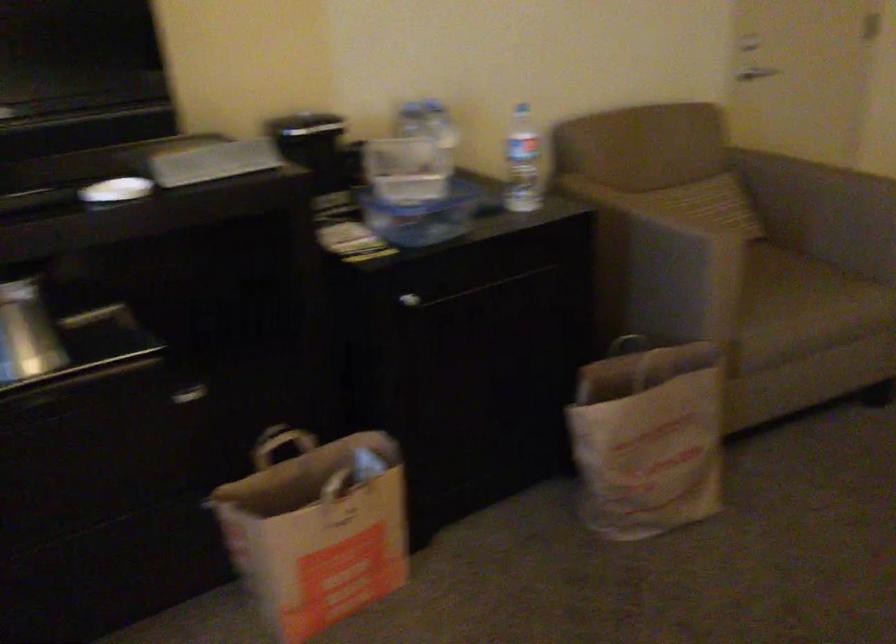
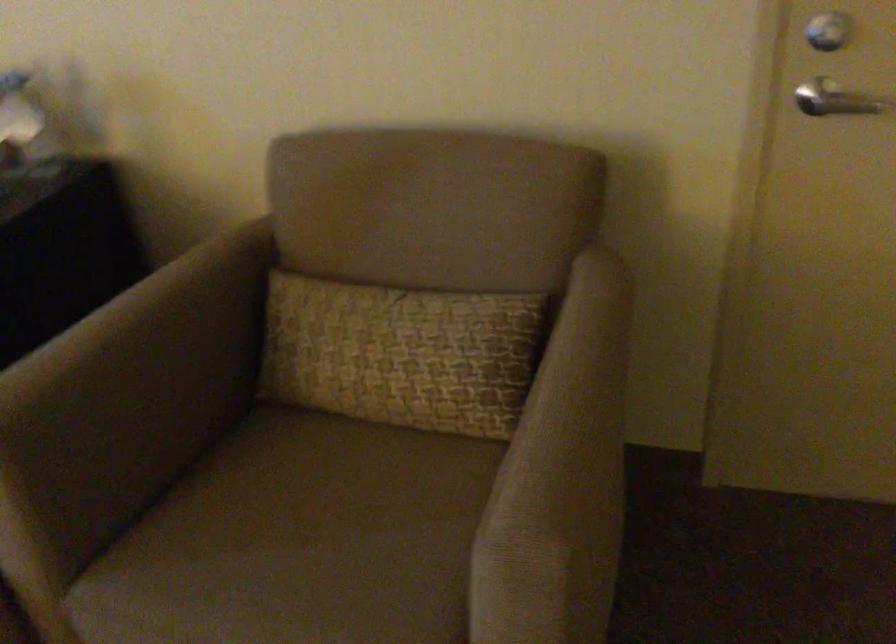
The point at (682, 234) is marked in the first image. Where is the corresponding point in the second image?

(135, 389)